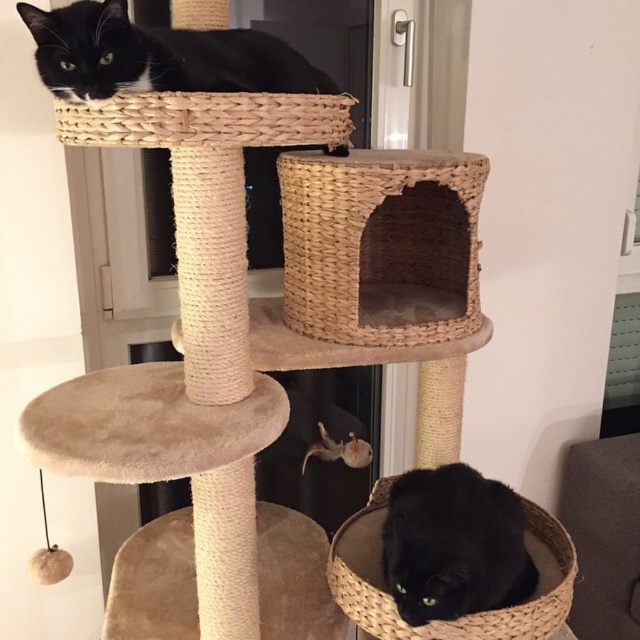
Question: Does woven beige basket at center appear on the left side of black matte cat at lower center?

Choices:
 (A) yes
 (B) no

Answer: (A)

Question: From the image, what is the correct spatial relationship of beige plush stool at center in relation to black matte cat at lower center?

Choices:
 (A) right
 (B) left

Answer: (B)

Question: Which object is closer to the camera taking this photo?

Choices:
 (A) black matte cat at lower center
 (B) woven straw basket at upper center
 (C) beige plush stool at center
 (D) woven beige basket at center

Answer: (B)

Question: Which object appears closest to the camera in this image?

Choices:
 (A) black matte cat at lower center
 (B) woven beige basket at center
 (C) beige plush stool at center
 (D) black matte cat at upper center

Answer: (D)

Question: Is black matte cat at upper center thinner than black matte cat at lower center?

Choices:
 (A) no
 (B) yes

Answer: (A)

Question: Which point is farther to the camera?

Choices:
 (A) black matte cat at upper center
 (B) woven beige basket at center
 (C) woven straw basket at upper center

Answer: (B)